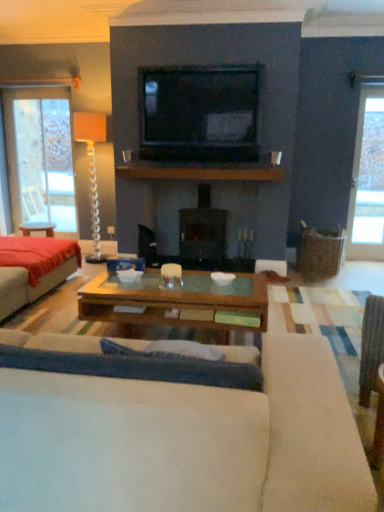
Question: Considering the relative positions of brown wooden mantle at center and translucent glass floor lamp at left in the image provided, is brown wooden mantle at center to the left or to the right of translucent glass floor lamp at left?

Choices:
 (A) right
 (B) left

Answer: (A)

Question: Relative to translucent glass floor lamp at left, is brown wooden mantle at center in front or behind?

Choices:
 (A) front
 (B) behind

Answer: (A)

Question: Which object is positioned farthest from the red fabric bed at left?

Choices:
 (A) matte white coffee cup at center
 (B) black glossy tv at upper center
 (C) dark gray stone fireplace at center
 (D) white fabric studio couch at center
 (E) translucent glass floor lamp at left

Answer: (D)

Question: Which of these objects is positioned closest to the black glossy tv at upper center?

Choices:
 (A) clear glass door at right, the second window when ordered from left to right
 (B) red fabric bed at left
 (C) matte white coffee cup at center
 (D) dark gray stone fireplace at center
 (E) white fabric studio couch at center

Answer: (C)